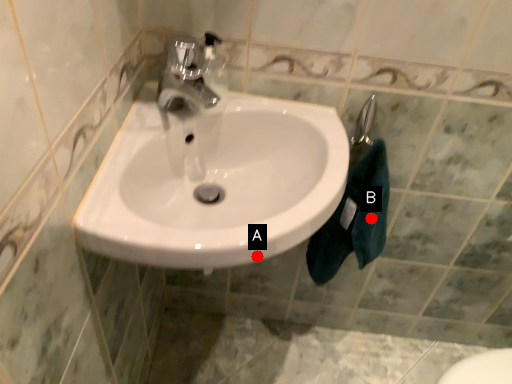
Question: Two points are circled on the image, labeled by A and B beside each circle. Among these points, which one is farthest from the camera?

Choices:
 (A) A is further
 (B) B is further

Answer: (B)